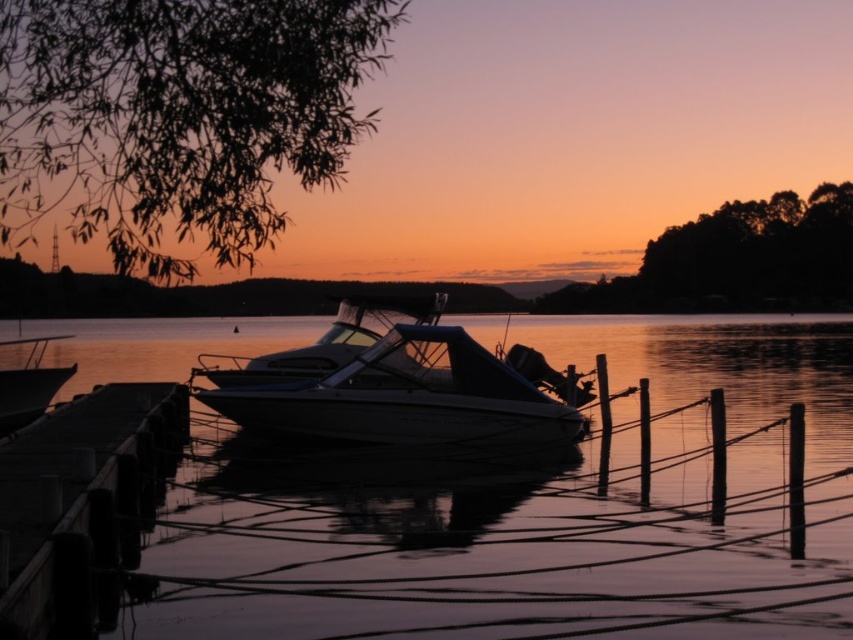
You are standing at the edge of the dock and want to walk towards the motorboat. Which point, point (x=39, y=506) or point (x=44, y=408), is closer to you as you start walking?

Point (x=39, y=506) is closer to the camera than point (x=44, y=408), so it is the closer point as you start walking.

You are a photographer standing on the dock and want to capture both the white glossy boat at center and the matte white boat at left in a single shot. Which boat should you position closer to the center of your camera frame to include both boats without cropping either?

You should position the white glossy boat at center closer to the center of your camera frame because it is already on the right side of the matte white boat at left, allowing both to fit within the frame when centered on it.

You are a fisherman who needs to board the matte white boat at left from the smooth wood dock at lower left. Can you walk directly to the boat without needing to swim?

The smooth wood dock at lower left is 14.92 feet away from the matte white boat at left. Since the distance is over 15 feet, you would need to swim to reach the boat from the smooth wood dock at lower left.